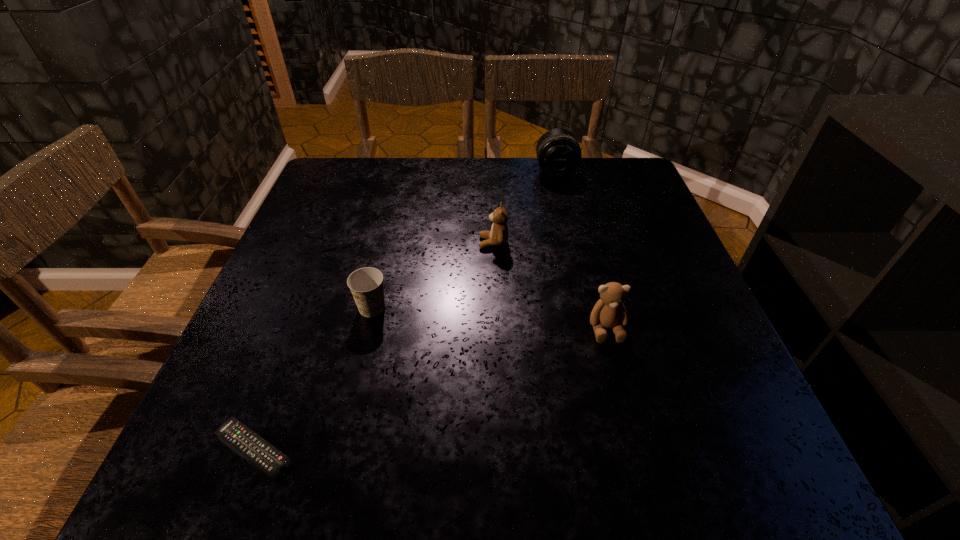
Locate an element on the screen. The height and width of the screenshot is (540, 960). the farthest object is located at coordinates (558, 152).

The height and width of the screenshot is (540, 960). I want to click on the second farthest object, so click(498, 236).

Find the location of a particular element. the farther teddy bear is located at coordinates (498, 236).

At what (x,y) coordinates should I click in order to perform the action: click on the nearer teddy bear. Please return your answer as a coordinate pair (x, y). The width and height of the screenshot is (960, 540). Looking at the image, I should click on (609, 312).

The image size is (960, 540). In order to click on Dixie cup in this screenshot , I will do `click(366, 284)`.

Where is `the fourth object from right to left`? Image resolution: width=960 pixels, height=540 pixels. the fourth object from right to left is located at coordinates (366, 284).

The height and width of the screenshot is (540, 960). Identify the location of the nearest object. (261, 453).

Where is `the shortest object`? The width and height of the screenshot is (960, 540). the shortest object is located at coordinates (261, 453).

Find the location of a particular element. blank space located on the front-facing side of the telephoto lens is located at coordinates (568, 226).

At what (x,y) coordinates should I click in order to perform the action: click on blank area located on the front-facing side of the left teddy bear. Please return your answer as a coordinate pair (x, y). The image size is (960, 540). Looking at the image, I should click on (325, 243).